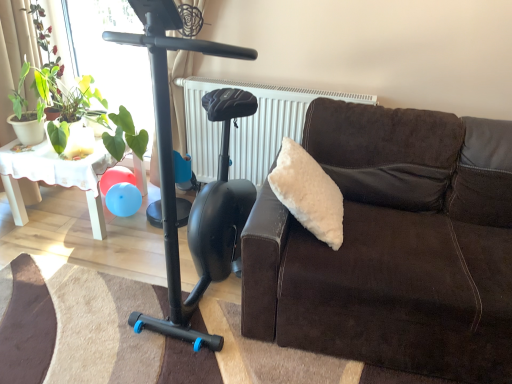
What do you see at coordinates (56, 101) in the screenshot? I see `green leafy plant at left, the 1th plant positioned from the right` at bounding box center [56, 101].

Where is `brown suede couch at right`? This screenshot has width=512, height=384. brown suede couch at right is located at coordinates (393, 246).

This screenshot has width=512, height=384. What do you see at coordinates (45, 39) in the screenshot?
I see `green leafy plant at upper left, the second plant positioned from the right` at bounding box center [45, 39].

The height and width of the screenshot is (384, 512). Describe the element at coordinates (172, 164) in the screenshot. I see `black matte mobility scooter at left` at that location.

Measure the distance between point (1,148) and camera.

7.13 feet.

In order to face white lace table at left, should I rotate leftwards or rightwards?

A 22.773 degree turn to the left will do.

Identify the location of white textured radiator at upper center. (249, 126).

Are white lace table at left and brown suede couch at right beside each other?

There is a gap between white lace table at left and brown suede couch at right.

Can you confirm if white lace table at left is bigger than brown suede couch at right?

Actually, white lace table at left might be smaller than brown suede couch at right.

Considering the positions of objects white lace table at left and brown suede couch at right in the image provided, who is more to the left, white lace table at left or brown suede couch at right?

white lace table at left.

Looking at their sizes, would you say white lace table at left is wider or thinner than brown suede couch at right?

white lace table at left is thinner than brown suede couch at right.

What's the angular difference between white textured radiator at upper center and green leafy plant at left, the 1th plant positioned from the right,'s facing directions?

→ 1.26 degrees.

Is white textured radiator at upper center inside or outside of green leafy plant at left, the 1th plant positioned from the right?

white textured radiator at upper center is outside green leafy plant at left, the 1th plant positioned from the right.

Identify the location of radiator below the green leafy plant at left, the 2th plant positioned from the left (from the image's perspective). The width and height of the screenshot is (512, 384). (249, 126).

Is white textured radiator at upper center oriented away from green leafy plant at left, the 1th plant positioned from the right?

white textured radiator at upper center is not turned away from green leafy plant at left, the 1th plant positioned from the right.

Is white textured radiator at upper center smaller than white lace table at left?

Correct, white textured radiator at upper center occupies less space than white lace table at left.

Between point (241, 123) and point (74, 169), which one is positioned in front?

The point (74, 169) is closer.

Which is in front, white textured radiator at upper center or white lace table at left?

white lace table at left is more forward.

Consider the image. From the image's perspective, between white lace table at left and green leafy plant at upper left, the second plant positioned from the right, who is located below?

From the image's view, white lace table at left is below.

From a real-world perspective, is white lace table at left positioned above or below green leafy plant at upper left, which is counted as the 1th plant, starting from the left?

From a real-world perspective, white lace table at left is physically below green leafy plant at upper left, which is counted as the 1th plant, starting from the left.

Is white lace table at left positioned with its back to green leafy plant at upper left, which is counted as the 1th plant, starting from the left?

No, white lace table at left is not facing the opposite direction of green leafy plant at upper left, which is counted as the 1th plant, starting from the left.

Between point (42, 171) and point (42, 8), which one is positioned in front?

The point (42, 171) is closer.

Considering their positions, is brown suede couch at right located in front of or behind green leafy plant at left, the 2th plant positioned from the left?

Visually, brown suede couch at right is located in front of green leafy plant at left, the 2th plant positioned from the left.

Can you confirm if brown suede couch at right is thinner than green leafy plant at left, the 1th plant positioned from the right?

No.

Is brown suede couch at right looking in the opposite direction of green leafy plant at left, the 2th plant positioned from the left?

No, brown suede couch at right is not facing the opposite direction of green leafy plant at left, the 2th plant positioned from the left.

Locate an element on the screen. The width and height of the screenshot is (512, 384). table below the brown suede couch at right (from a real-world perspective) is located at coordinates (55, 178).

Considering the positions of point (338, 348) and point (49, 145), is point (338, 348) closer or farther from the camera than point (49, 145)?

Clearly, point (338, 348) is closer to the camera than point (49, 145).

Can you tell me how much brown suede couch at right and white lace table at left differ in facing direction?

The angle between the facing direction of brown suede couch at right and the facing direction of white lace table at left is 0.53 degrees.

Considering the relative sizes of brown suede couch at right and white lace table at left in the image provided, is brown suede couch at right smaller than white lace table at left?

No.

You are a GUI agent. You are given a task and a screenshot of the screen. Output one action in this format:
    pyautogui.click(x=<x>, y=<y>)
    Task: Click on the plant to the right of green leafy plant at upper left, the second plant positioned from the right
    
    Given the screenshot: What is the action you would take?
    (56, 101)

From a real-world perspective, is green leafy plant at upper left, the second plant positioned from the right, physically above green leafy plant at left, the 2th plant positioned from the left?

Yes.

Considering the sizes of green leafy plant at upper left, which is counted as the 1th plant, starting from the left, and green leafy plant at left, the 2th plant positioned from the left, in the image, is green leafy plant at upper left, which is counted as the 1th plant, starting from the left, taller or shorter than green leafy plant at left, the 2th plant positioned from the left,?

Considering their sizes, green leafy plant at upper left, which is counted as the 1th plant, starting from the left, has less height than green leafy plant at left, the 2th plant positioned from the left.

Can you tell me how much green leafy plant at upper left, which is counted as the 1th plant, starting from the left, and green leafy plant at left, the 2th plant positioned from the left, differ in facing direction?

The angular difference between green leafy plant at upper left, which is counted as the 1th plant, starting from the left, and green leafy plant at left, the 2th plant positioned from the left, is 0.000125 degrees.

Where is `studio couch in front of the white lace table at left`? This screenshot has height=384, width=512. studio couch in front of the white lace table at left is located at coordinates (393, 246).

Image resolution: width=512 pixels, height=384 pixels. Identify the location of radiator below the green leafy plant at left, the 1th plant positioned from the right (from a real-world perspective). (249, 126).

Estimate the real-world distances between objects in this image. Which object is further from brown suede couch at right, black matte mobility scooter at left or green leafy plant at left, the 2th plant positioned from the left?

green leafy plant at left, the 2th plant positioned from the left.

When comparing their distances from black matte mobility scooter at left, does green leafy plant at left, the 1th plant positioned from the right, or white lace table at left seem closer?

The object closer to black matte mobility scooter at left is green leafy plant at left, the 1th plant positioned from the right.

From the image, which object appears to be nearer to black matte mobility scooter at left, white lace table at left or green leafy plant at left, the 1th plant positioned from the right?

The object closer to black matte mobility scooter at left is green leafy plant at left, the 1th plant positioned from the right.

Based on their spatial positions, is white lace table at left or green leafy plant at upper left, the second plant positioned from the right, closer to green leafy plant at left, the 1th plant positioned from the right?

Among the two, white lace table at left is located nearer to green leafy plant at left, the 1th plant positioned from the right.

Which object lies further to the anchor point green leafy plant at left, the 2th plant positioned from the left, green leafy plant at upper left, the second plant positioned from the right, or white textured radiator at upper center?

white textured radiator at upper center is further to green leafy plant at left, the 2th plant positioned from the left.

Which object lies further to the anchor point green leafy plant at upper left, which is counted as the 1th plant, starting from the left, brown suede couch at right or white lace table at left?

brown suede couch at right lies further to green leafy plant at upper left, which is counted as the 1th plant, starting from the left, than the other object.

Looking at this image, looking at the image, which one is located further to green leafy plant at left, the 1th plant positioned from the right, white textured radiator at upper center or black matte mobility scooter at left?

black matte mobility scooter at left is further to green leafy plant at left, the 1th plant positioned from the right.

Looking at this image, based on their spatial positions, is white textured radiator at upper center or white lace table at left further from green leafy plant at left, the 1th plant positioned from the right?

white textured radiator at upper center lies further to green leafy plant at left, the 1th plant positioned from the right, than the other object.

You are a GUI agent. You are given a task and a screenshot of the screen. Output one action in this format:
    pyautogui.click(x=<x>, y=<y>)
    Task: Click on the radiator between white lace table at left and brown suede couch at right
    The height and width of the screenshot is (384, 512).
    Given the screenshot: What is the action you would take?
    pyautogui.click(x=249, y=126)

Image resolution: width=512 pixels, height=384 pixels. I want to click on mobility scooter between white lace table at left and white textured radiator at upper center in the horizontal direction, so click(x=172, y=164).

Where is `plant between black matte mobility scooter at left and green leafy plant at upper left, which is counted as the 1th plant, starting from the left, along the z-axis`? This screenshot has width=512, height=384. plant between black matte mobility scooter at left and green leafy plant at upper left, which is counted as the 1th plant, starting from the left, along the z-axis is located at coordinates (56, 101).

At what (x,y) coordinates should I click in order to perform the action: click on mobility scooter situated between white lace table at left and brown suede couch at right from left to right. Please return your answer as a coordinate pair (x, y). Looking at the image, I should click on (172, 164).